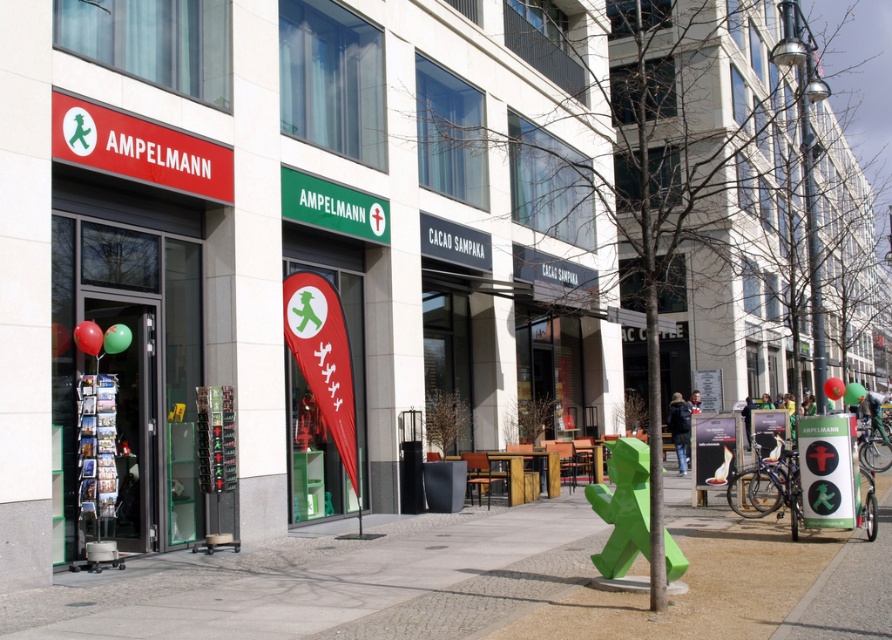
Question: Does green concrete pavement at center have a smaller size compared to green plastic pedestrian sign at center?

Choices:
 (A) yes
 (B) no

Answer: (B)

Question: Is green plastic pedestrian sign at center positioned behind green matte sign at center?

Choices:
 (A) yes
 (B) no

Answer: (B)

Question: Among these objects, which one is farthest from the camera?

Choices:
 (A) green matte sign at center
 (B) green plastic pedestrian sign at center
 (C) green concrete pavement at center

Answer: (A)

Question: Among these points, which one is nearest to the camera?

Choices:
 (A) (409, 566)
 (B) (296, 196)
 (C) (816, 429)

Answer: (A)

Question: Does green concrete pavement at center come behind green plastic pedestrian sign at center?

Choices:
 (A) no
 (B) yes

Answer: (A)

Question: Which point is closer to the camera?

Choices:
 (A) green matte sign at center
 (B) green plastic pedestrian sign at center

Answer: (B)